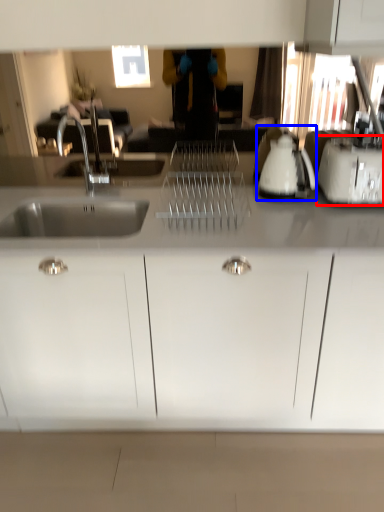
Question: Which of the following is the closest to the observer, toaster (highlighted by a red box) or appliance (highlighted by a blue box)?

Choices:
 (A) toaster
 (B) appliance

Answer: (A)